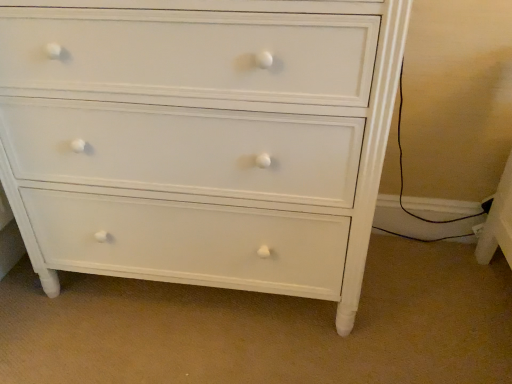
The width and height of the screenshot is (512, 384). In order to click on white painted wood chest of drawers at center in this screenshot , I will do `click(200, 139)`.

This screenshot has height=384, width=512. Describe the element at coordinates (200, 139) in the screenshot. I see `white painted wood chest of drawers at center` at that location.

In order to face white painted wood chest of drawers at center, should I rotate leftwards or rightwards?

A 7.623 degree turn to the left will do.

Where is `white painted wood chest of drawers at center`? The height and width of the screenshot is (384, 512). white painted wood chest of drawers at center is located at coordinates 200,139.